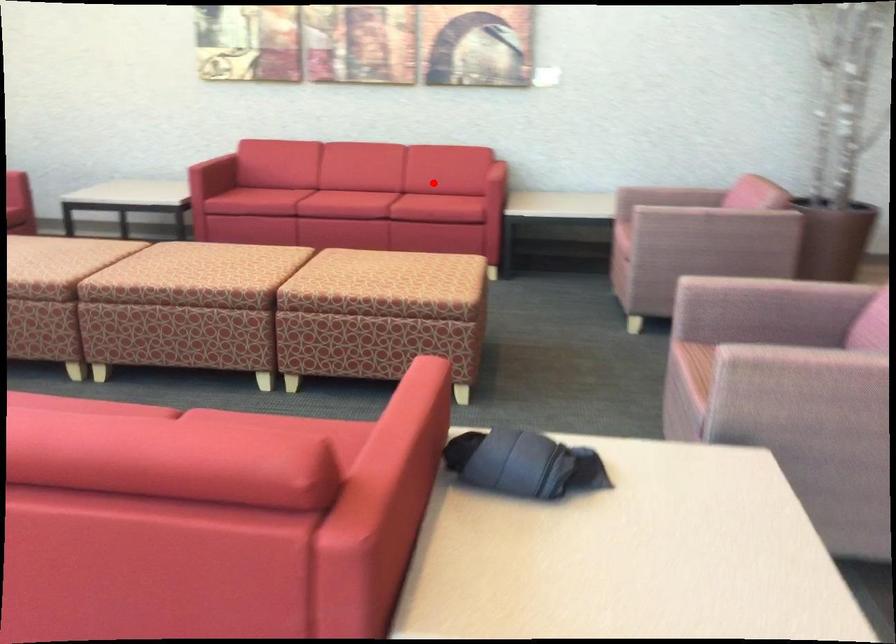
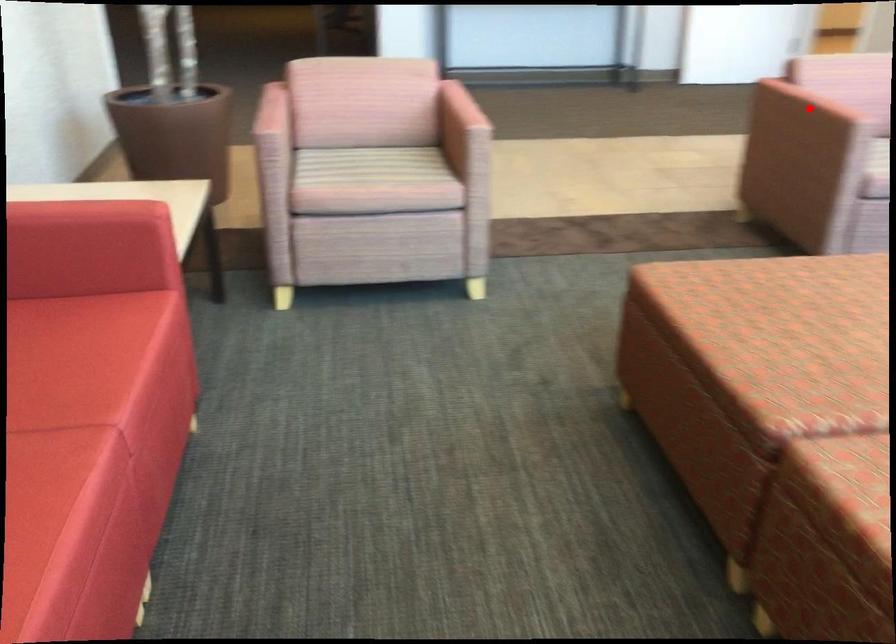
I am providing you with two images of the same scene from different viewpoints. A red point is marked on the first image and another point is marked on the second image. Do the highlighted points in image1 and image2 indicate the same real-world spot?

No